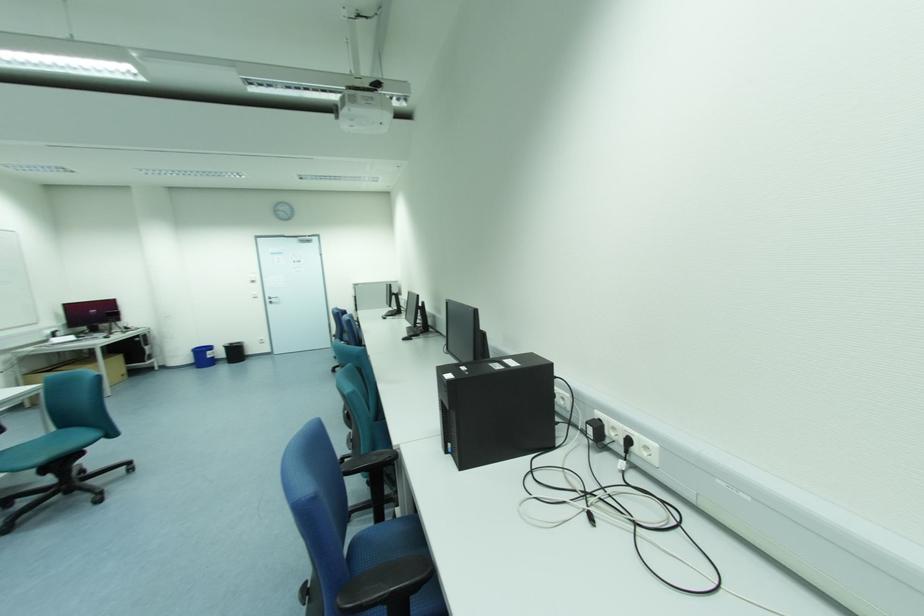
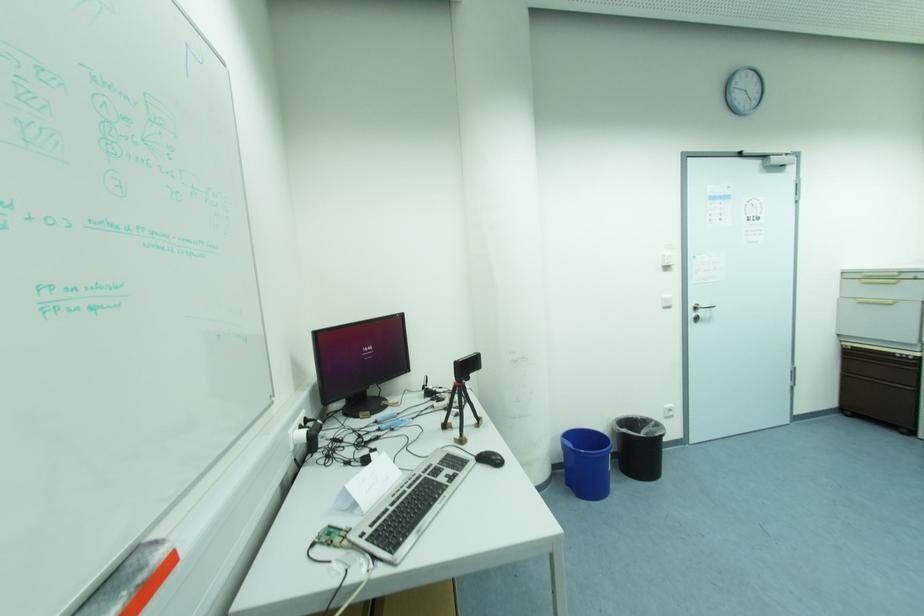
Find the pixel in the second image that matches point 261,339 in the first image.

(667, 406)